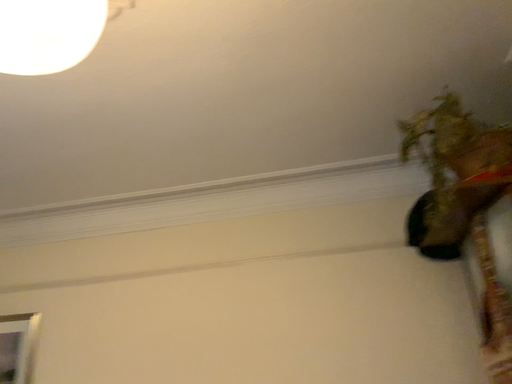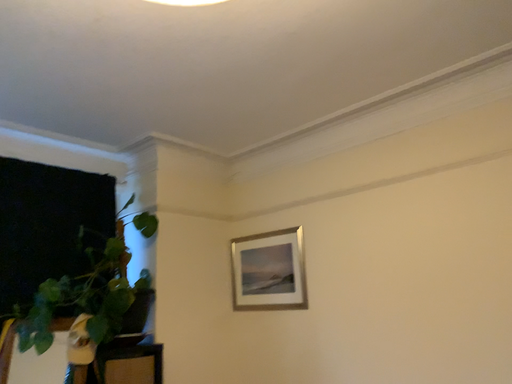
Question: How did the camera likely rotate when shooting the video?

Choices:
 (A) rotated right
 (B) rotated left

Answer: (B)